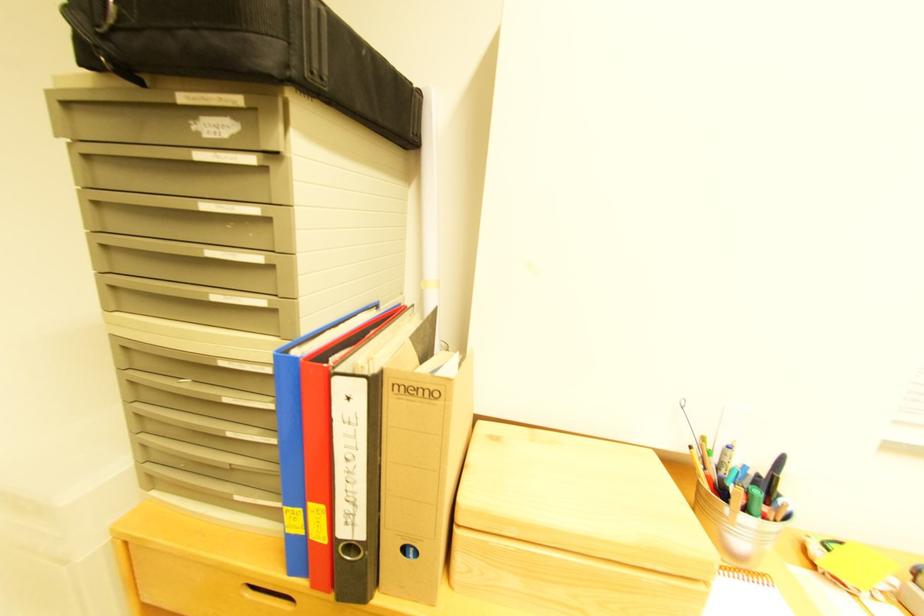
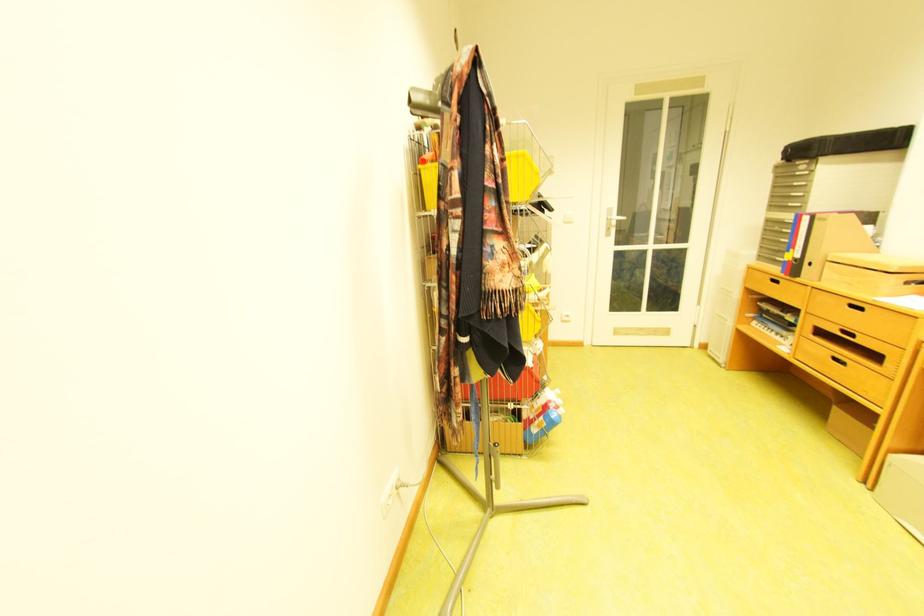
In the second image, find the point that corresponds to pixel 371 536 in the first image.

(809, 257)